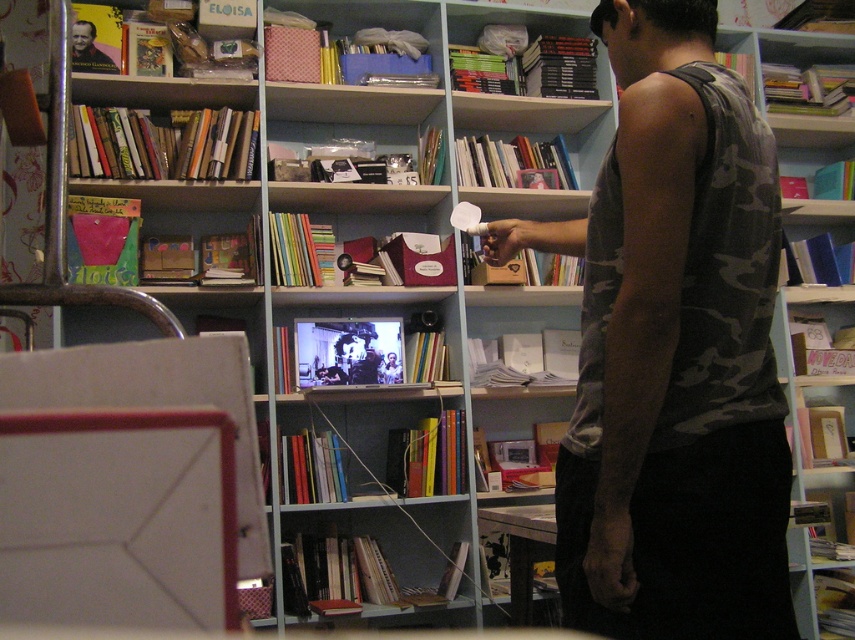
Question: Is camouflage tank top at center positioned behind smooth brown book at upper left?

Choices:
 (A) no
 (B) yes

Answer: (A)

Question: Does camouflage tank top at center have a smaller size compared to smooth brown book at upper left?

Choices:
 (A) no
 (B) yes

Answer: (A)

Question: Which point is farther to the camera?

Choices:
 (A) (x=598, y=554)
 (B) (x=104, y=54)

Answer: (B)

Question: Is camouflage tank top at center closer to camera compared to smooth brown book at upper left?

Choices:
 (A) no
 (B) yes

Answer: (B)